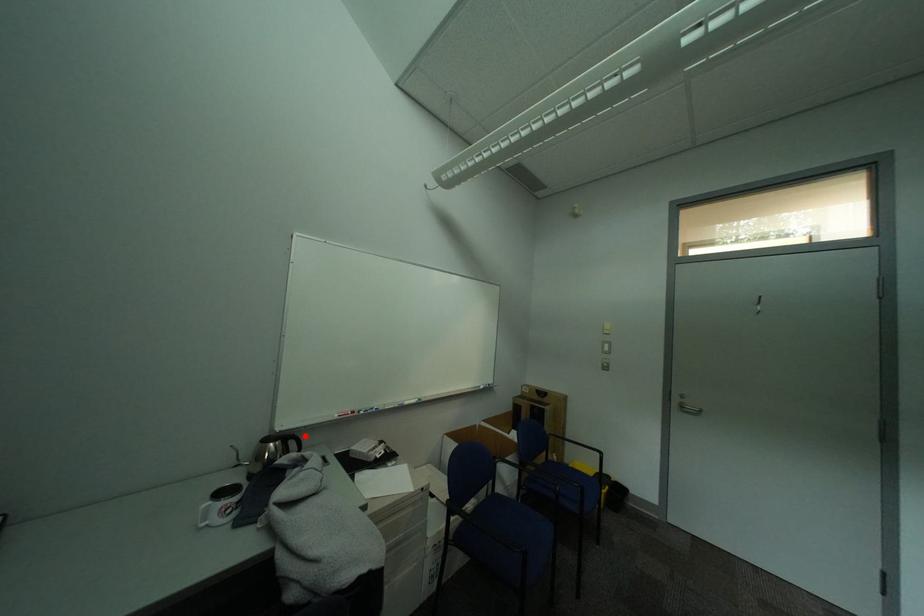
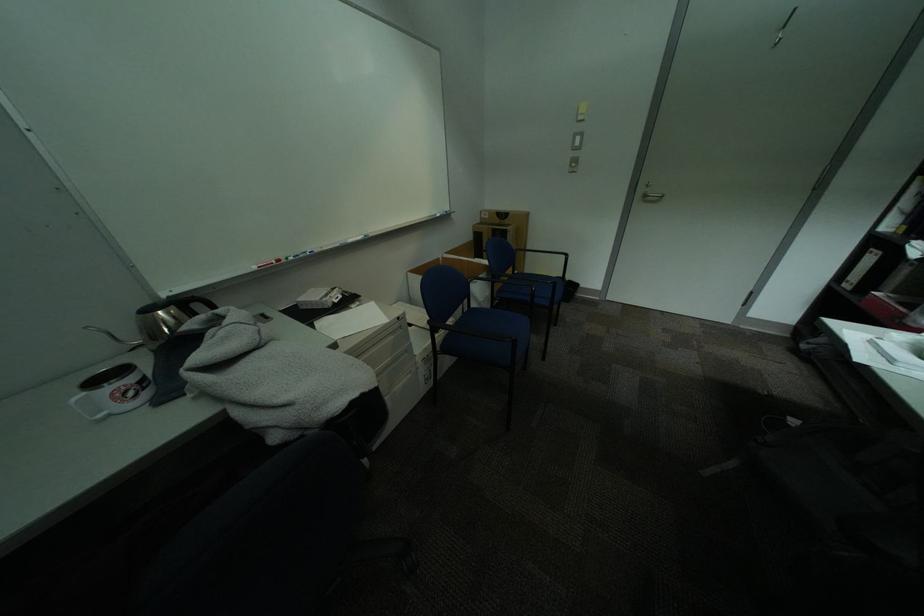
Locate, in the second image, the point that corresponds to the highlighted location in the first image.

(204, 297)